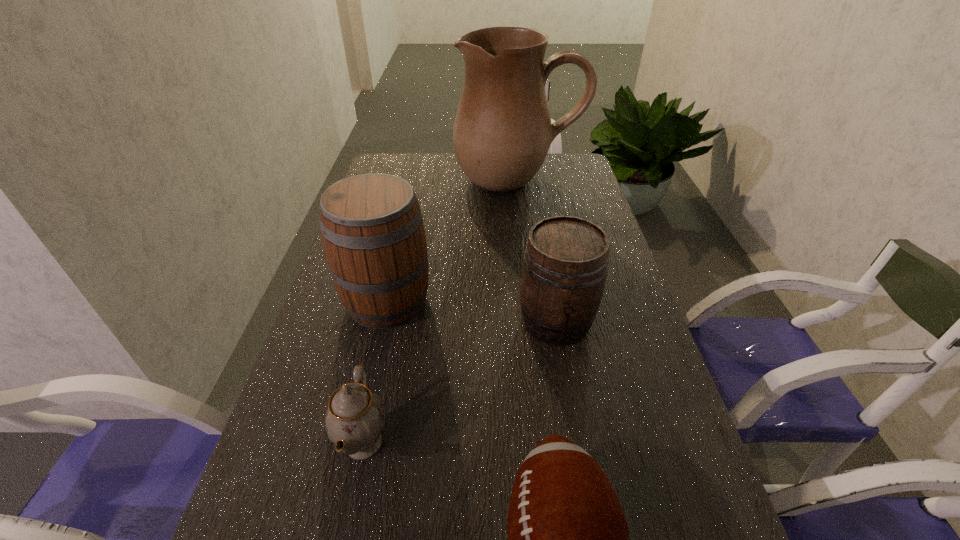
The image size is (960, 540). I want to click on vacant area situated 0.140m on the spout of the chinaware, so click(464, 443).

You are a GUI agent. You are given a task and a screenshot of the screen. Output one action in this format:
    pyautogui.click(x=<x>, y=<y>)
    Task: Click on the object that is at the far edge
    This screenshot has width=960, height=540.
    Given the screenshot: What is the action you would take?
    pyautogui.click(x=502, y=132)

This screenshot has width=960, height=540. Identify the location of cider present at the left edge. [x=372, y=230].

Identify the location of chinaware located at the left edge. This screenshot has height=540, width=960. (355, 418).

Locate an element on the screen. The width and height of the screenshot is (960, 540). cream pitcher at the right edge is located at coordinates (502, 132).

The height and width of the screenshot is (540, 960). Find the location of `cider at the right edge`. cider at the right edge is located at coordinates (565, 264).

This screenshot has width=960, height=540. I want to click on object present at the far right corner, so click(x=502, y=132).

Identify the location of free space at the far edge of the desktop. (450, 169).

Where is `vacant area at the left edge of the desktop`? vacant area at the left edge of the desktop is located at coordinates (287, 427).

This screenshot has height=540, width=960. In the image, there is a desktop. What are the coordinates of `vacant space at the right edge` in the screenshot? It's located at (708, 492).